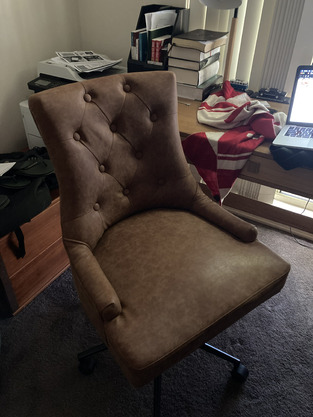
I want to click on trackpad, so click(x=311, y=144).